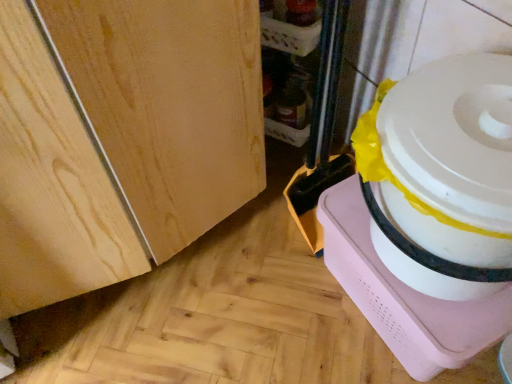
Question: Should I look upward or downward to see white plastic container at right?

Choices:
 (A) up
 (B) down

Answer: (A)